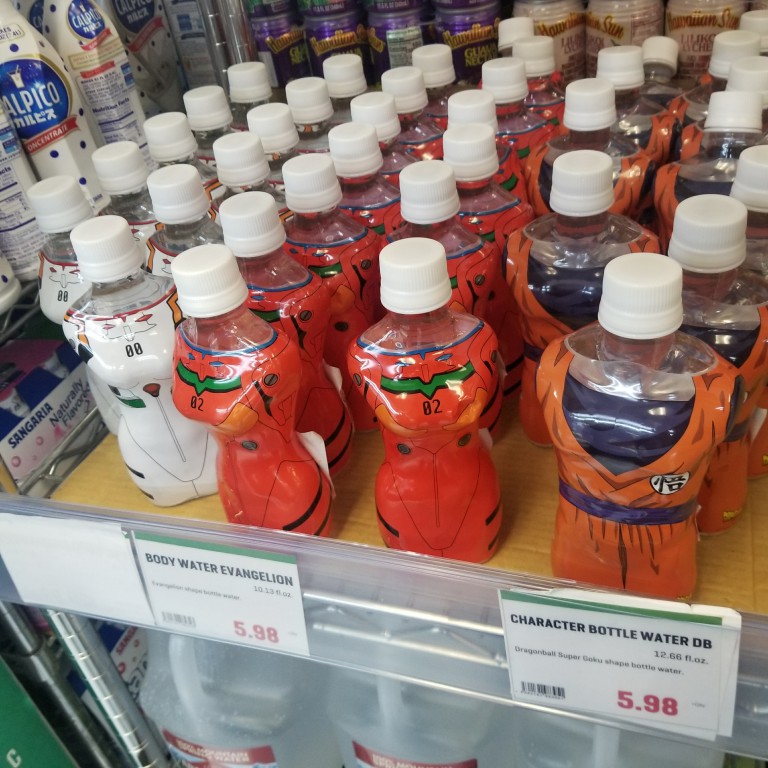
Where is `top shelf`? This screenshot has width=768, height=768. top shelf is located at coordinates (330, 429).